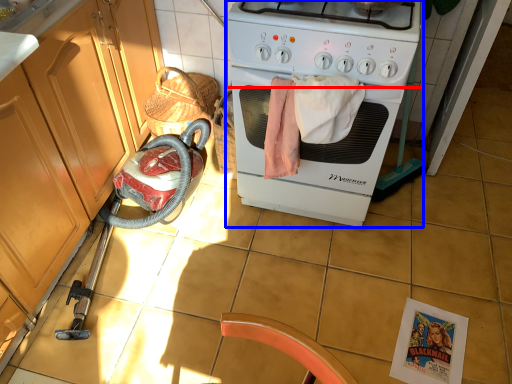
Question: Which point is further to the camera, gas stove (highlighted by a red box) or home appliance (highlighted by a blue box)?

Choices:
 (A) gas stove
 (B) home appliance

Answer: (B)